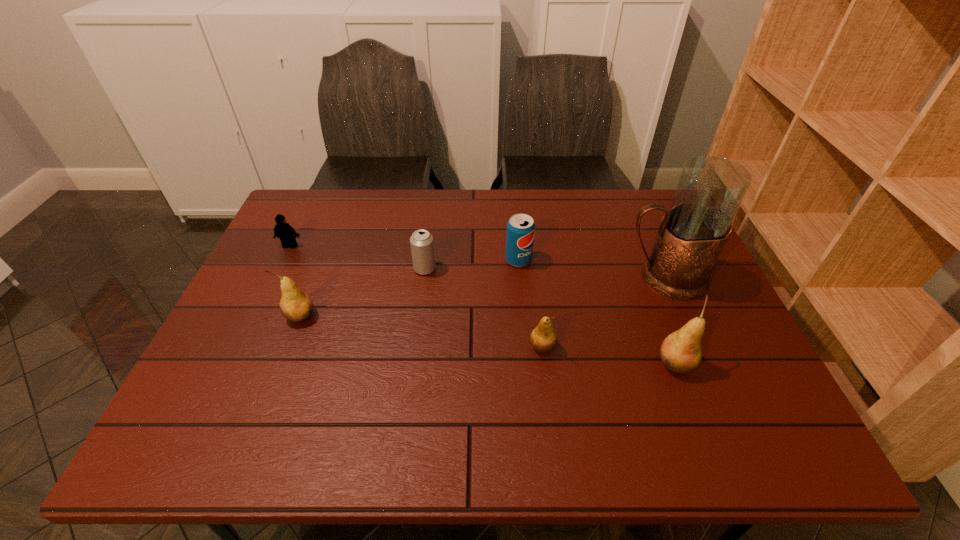
In order to click on the second shortest pear in this screenshot , I will do `click(295, 305)`.

Where is `the fifth farthest object`? the fifth farthest object is located at coordinates (295, 305).

I want to click on the second pear from left to right, so click(543, 338).

Locate an element on the screen. the rightmost pear is located at coordinates (681, 351).

In order to click on the farthest object in this screenshot , I will do `click(282, 230)`.

At what (x,y) coordinates should I click in order to perform the action: click on the leftmost object. Please return your answer as a coordinate pair (x, y). This screenshot has height=540, width=960. Looking at the image, I should click on (282, 230).

Identify the location of pitcher. This screenshot has height=540, width=960. (693, 232).

Where is `soda can`? soda can is located at coordinates (520, 228).

The image size is (960, 540). Find the location of `beer can`. beer can is located at coordinates (422, 246).

At what (x,y) coordinates should I click in order to perform the action: click on free spot located on the back of the second tallest pear. Please return your answer as a coordinate pair (x, y). The image size is (960, 540). Looking at the image, I should click on (320, 269).